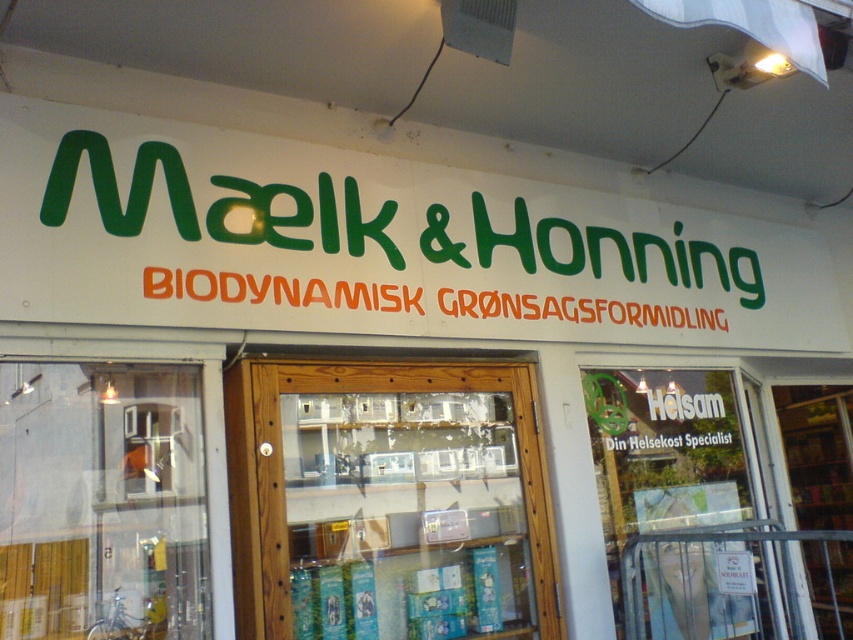
You are standing in front of the shop entrance. Where exactly is the wooden door at center located in terms of coordinates?

The wooden door at center is located at point (389,502).

You are a delivery person with a box that is 30 inches wide. You need to enter the shop through the wooden door at center and the transparent glass door at center. Can your box fit through the space between them?

The distance between the wooden door at center and the transparent glass door at center is 31.64 inches. Since your box is 30 inches wide, it can fit through the space between them as the width of the space is greater than the box.